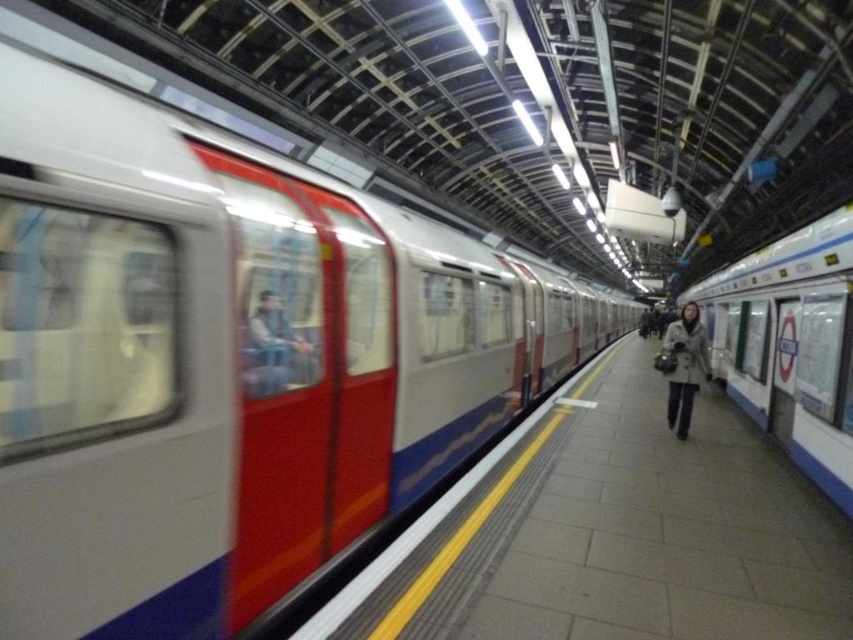
You are a passenger waiting on the smooth concrete platform at center. You look up and see the white glossy train at right. Is the train above or below you?

The smooth concrete platform at center is located below the white glossy train at right, so the train is above you.

You are a passenger waiting on the smooth concrete platform at center. You want to board the white glossy train at right. Is the train currently stopped at the platform or moving away?

The smooth concrete platform at center is in front of the white glossy train at right, which means the train is stopped at the platform since the platform is positioned directly in front of it.